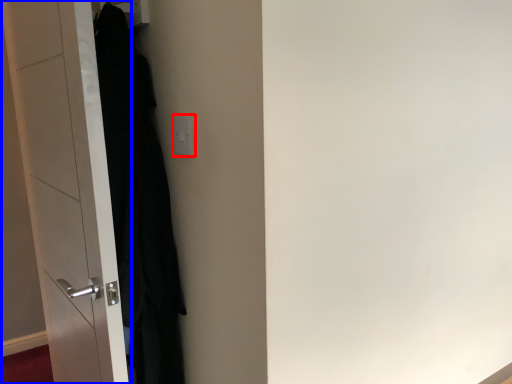
Question: Which object appears farthest to the camera in this image, electric outlet (highlighted by a red box) or door (highlighted by a blue box)?

Choices:
 (A) electric outlet
 (B) door

Answer: (A)